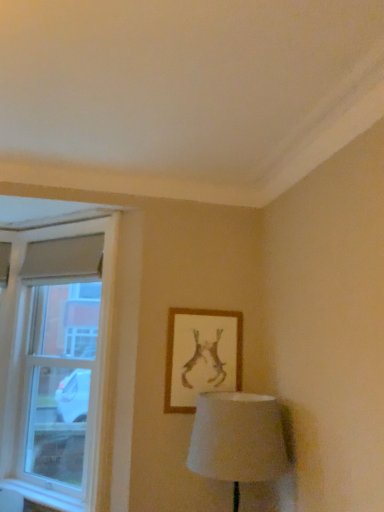
What is the approximate width of white glass window at left?

It is 9.11 inches.

Image resolution: width=384 pixels, height=512 pixels. What do you see at coordinates (201, 356) in the screenshot?
I see `wooden framed artwork at upper center` at bounding box center [201, 356].

At what (x,y) coordinates should I click in order to perform the action: click on white plastic window sill at lower left. Please return your answer as a coordinate pair (x, y). This screenshot has width=384, height=512. Looking at the image, I should click on (43, 496).

You are a GUI agent. You are given a task and a screenshot of the screen. Output one action in this format:
    pyautogui.click(x=<x>, y=<y>)
    Task: Click on the white glass window at left
    
    Given the screenshot: What is the action you would take?
    [x=58, y=362]

In the image, is wooden framed artwork at upper center on the left side or the right side of white plastic window sill at lower left?

wooden framed artwork at upper center is to the right of white plastic window sill at lower left.

Would you say wooden framed artwork at upper center is inside or outside white plastic window sill at lower left?

wooden framed artwork at upper center is located beyond the bounds of white plastic window sill at lower left.

Which point is more forward, (193, 372) or (5, 482)?

Point (193, 372)

You are a GUI agent. You are given a task and a screenshot of the screen. Output one action in this format:
    pyautogui.click(x=<x>, y=<y>)
    Task: Click on the window located above the white plastic window sill at lower left (from the image's perspective)
    This screenshot has width=384, height=512.
    Given the screenshot: What is the action you would take?
    pyautogui.click(x=58, y=362)

Which of these two, white plastic window sill at lower left or white glass window at left, is thinner?

white plastic window sill at lower left is thinner.

From the image's perspective, who appears lower, white plastic window sill at lower left or wooden framed artwork at upper center?

white plastic window sill at lower left.

From a real-world perspective, is white plastic window sill at lower left located beneath wooden framed artwork at upper center?

Correct, in the physical world, white plastic window sill at lower left is lower than wooden framed artwork at upper center.

Is white plastic window sill at lower left aimed at wooden framed artwork at upper center?

No, white plastic window sill at lower left is not aimed at wooden framed artwork at upper center.

Considering the sizes of objects white plastic window sill at lower left and wooden framed artwork at upper center in the image provided, who is wider, white plastic window sill at lower left or wooden framed artwork at upper center?

With larger width is white plastic window sill at lower left.

Considering the sizes of objects wooden framed artwork at upper center and white glass window at left in the image provided, who is bigger, wooden framed artwork at upper center or white glass window at left?

Bigger between the two is white glass window at left.

Are wooden framed artwork at upper center and white glass window at left beside each other?

No, wooden framed artwork at upper center is not beside white glass window at left.

Do you think wooden framed artwork at upper center is within white glass window at left, or outside of it?

wooden framed artwork at upper center is located beyond the bounds of white glass window at left.

Is wooden framed artwork at upper center turned away from white glass window at left?

No, wooden framed artwork at upper center is not facing away from white glass window at left.

Locate an element on the screen. This screenshot has height=512, width=384. window located above the wooden framed artwork at upper center (from a real-world perspective) is located at coordinates (58, 362).

From their relative heights in the image, would you say white glass window at left is taller or shorter than wooden framed artwork at upper center?

In the image, white glass window at left appears to be taller than wooden framed artwork at upper center.

Is white glass window at left surrounding wooden framed artwork at upper center?

That's incorrect, wooden framed artwork at upper center is not inside white glass window at left.

From the image's perspective, between white glass window at left and wooden framed artwork at upper center, who is located below?

From the image's view, white glass window at left is below.

Is white glass window at left directly adjacent to white plastic window sill at lower left?

white glass window at left and white plastic window sill at lower left are not in contact.

What's the angular difference between white glass window at left and white plastic window sill at lower left's facing directions?

There is a 0.00443-degree angle between the facing directions of white glass window at left and white plastic window sill at lower left.

From the image's perspective, is white glass window at left above or below white plastic window sill at lower left?

Based on their image positions, white glass window at left is located above white plastic window sill at lower left.

From the picture: Considering the relative positions of white glass window at left and white plastic window sill at lower left in the image provided, is white glass window at left to the left or to the right of white plastic window sill at lower left?

Based on their positions, white glass window at left is located to the right of white plastic window sill at lower left.

Where is `window sill that is under the wooden framed artwork at upper center (from a real-world perspective)`? This screenshot has width=384, height=512. window sill that is under the wooden framed artwork at upper center (from a real-world perspective) is located at coordinates (43, 496).

Where is `window sill on the left side of white glass window at left`? The width and height of the screenshot is (384, 512). window sill on the left side of white glass window at left is located at coordinates (43, 496).

When comparing their distances from wooden framed artwork at upper center, does white glass window at left or white plastic window sill at lower left seem closer?

Based on the image, white glass window at left appears to be nearer to wooden framed artwork at upper center.

Looking at the image, which one is located further to white plastic window sill at lower left, wooden framed artwork at upper center or white glass window at left?

The object further to white plastic window sill at lower left is wooden framed artwork at upper center.

Looking at the image, which one is located further to white glass window at left, white plastic window sill at lower left or wooden framed artwork at upper center?

wooden framed artwork at upper center is positioned further to the anchor white glass window at left.

From the picture: Which object lies further to the anchor point white plastic window sill at lower left, white glass window at left or wooden framed artwork at upper center?

wooden framed artwork at upper center.

From the picture: Which object lies nearer to the anchor point wooden framed artwork at upper center, white plastic window sill at lower left or white glass window at left?

white glass window at left lies closer to wooden framed artwork at upper center than the other object.

Which object lies nearer to the anchor point white glass window at left, wooden framed artwork at upper center or white plastic window sill at lower left?

white plastic window sill at lower left lies closer to white glass window at left than the other object.

Where is `window located between white plastic window sill at lower left and wooden framed artwork at upper center in the left-right direction`? The image size is (384, 512). window located between white plastic window sill at lower left and wooden framed artwork at upper center in the left-right direction is located at coordinates (58, 362).